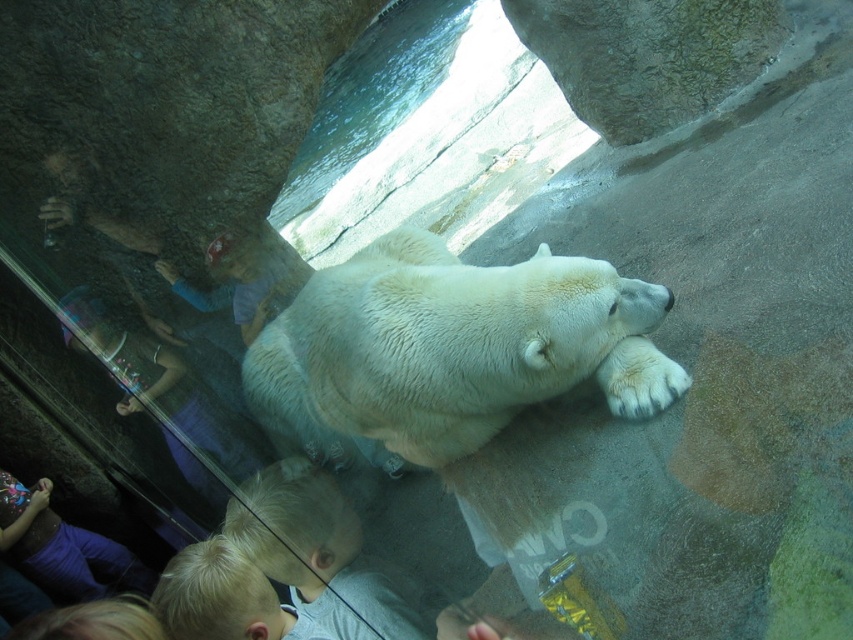
Question: Does white fluffy polar bear at center have a larger size compared to white fur paw at lower center?

Choices:
 (A) no
 (B) yes

Answer: (B)

Question: Among these objects, which one is farthest from the camera?

Choices:
 (A) white fluffy polar bear at center
 (B) white fur paw at lower center

Answer: (B)

Question: Among these objects, which one is farthest from the camera?

Choices:
 (A) white fur paw at lower center
 (B) white fluffy polar bear at center

Answer: (A)

Question: Does white fluffy polar bear at center have a greater width compared to white fur paw at lower center?

Choices:
 (A) no
 (B) yes

Answer: (B)

Question: Which object appears farthest from the camera in this image?

Choices:
 (A) white fur paw at lower center
 (B) white fluffy polar bear at center

Answer: (A)

Question: From the image, what is the correct spatial relationship of white fluffy polar bear at center in relation to white fur paw at lower center?

Choices:
 (A) above
 (B) below

Answer: (A)